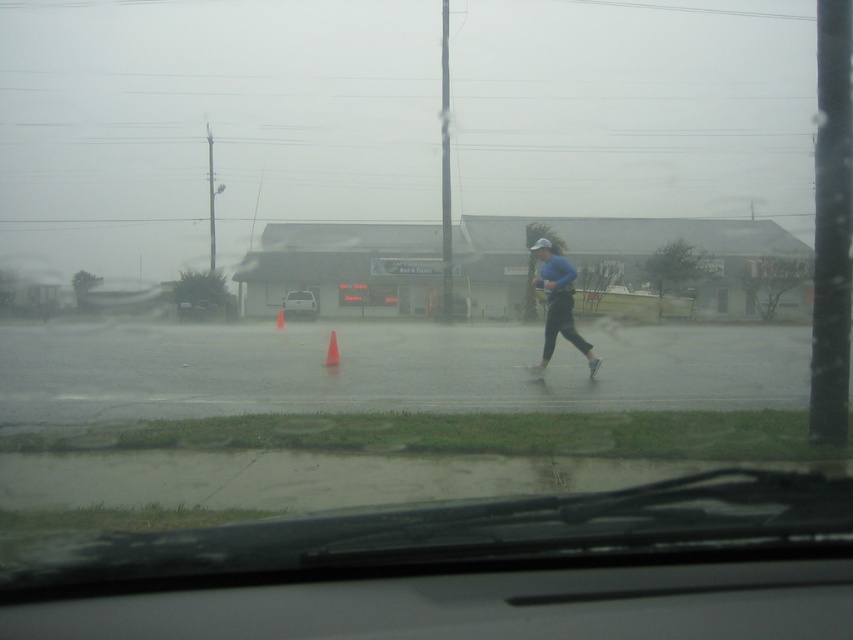
Can you confirm if blue matte running suit at center is positioned above orange cone at center?

Incorrect, blue matte running suit at center is not positioned above orange cone at center.

Measure the distance from blue matte running suit at center to orange cone at center.

They are 16.51 meters apart.

Does point (558, 316) come behind point (277, 324)?

No, (558, 316) is closer to viewer.

At what (x,y) coordinates should I click in order to perform the action: click on blue matte running suit at center. Please return your answer as a coordinate pair (x, y). The height and width of the screenshot is (640, 853). Looking at the image, I should click on (558, 304).

Consider the image. Can you confirm if orange plastic cone at center is positioned to the left of orange cone at center?

In fact, orange plastic cone at center is to the right of orange cone at center.

Which is above, orange plastic cone at center or orange cone at center?

orange cone at center

Which is in front, point (337, 358) or point (281, 320)?

Positioned in front is point (337, 358).

The height and width of the screenshot is (640, 853). What are the coordinates of `orange plastic cone at center` in the screenshot? It's located at (332, 349).

Can you confirm if blue matte running suit at center is smaller than orange plastic cone at center?

Actually, blue matte running suit at center might be larger than orange plastic cone at center.

Between blue matte running suit at center and orange plastic cone at center, which one has more height?

Standing taller between the two is blue matte running suit at center.

Locate an element on the screen. The image size is (853, 640). blue matte running suit at center is located at coordinates (558, 304).

The height and width of the screenshot is (640, 853). I want to click on blue matte running suit at center, so click(x=558, y=304).